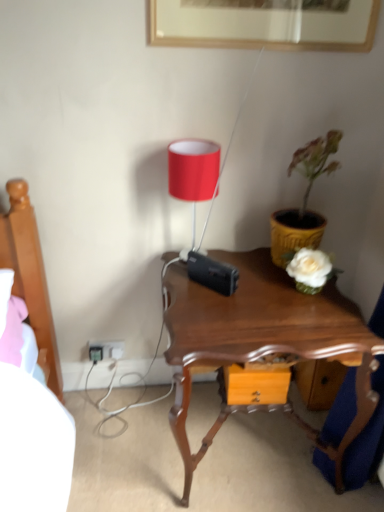
The height and width of the screenshot is (512, 384). I want to click on vacant area that is in front of matte red lampshade at upper center, so click(x=197, y=291).